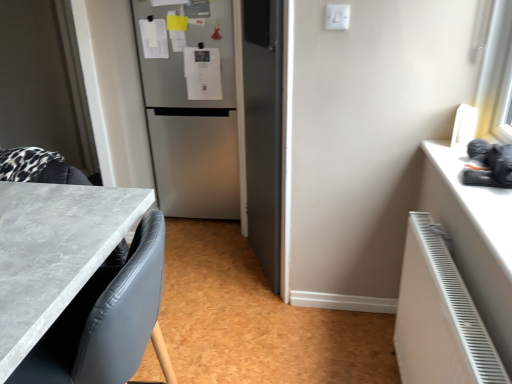
What do you see at coordinates (439, 317) in the screenshot?
I see `white matte radiator at lower right` at bounding box center [439, 317].

Locate an element on the screen. white matte counter top at right is located at coordinates (478, 202).

The height and width of the screenshot is (384, 512). I want to click on gray marble countertop at lower left, so click(x=54, y=250).

The height and width of the screenshot is (384, 512). I want to click on countertop that appears in front of the white matte counter top at right, so click(54, 250).

Considering the sizes of objects white matte counter top at right and gray marble countertop at lower left in the image provided, who is thinner, white matte counter top at right or gray marble countertop at lower left?

Thinner between the two is white matte counter top at right.

Does white matte counter top at right contain gray marble countertop at lower left?

No, gray marble countertop at lower left is not a part of white matte counter top at right.

Consider the image. Is white matte counter top at right far away from gray marble countertop at lower left?

Absolutely, white matte counter top at right is distant from gray marble countertop at lower left.

Between gray marble countertop at lower left and stainless steel refrigerator at center, which one appears on the right side from the viewer's perspective?

From the viewer's perspective, stainless steel refrigerator at center appears more on the right side.

From a real-world perspective, is gray marble countertop at lower left physically above stainless steel refrigerator at center?

No, from a real-world perspective, gray marble countertop at lower left is not over stainless steel refrigerator at center

Is gray marble countertop at lower left thinner than stainless steel refrigerator at center?

Indeed, gray marble countertop at lower left has a lesser width compared to stainless steel refrigerator at center.

Is gray marble countertop at lower left next to stainless steel refrigerator at center?

No, gray marble countertop at lower left is not in contact with stainless steel refrigerator at center.

Based on the photo, is gray marble countertop at lower left wider than white matte radiator at lower right?

Indeed, gray marble countertop at lower left has a greater width compared to white matte radiator at lower right.

Is there a large distance between gray marble countertop at lower left and white matte radiator at lower right?

Actually, gray marble countertop at lower left and white matte radiator at lower right are a little close together.

Identify the location of radiator behind the gray marble countertop at lower left. (439, 317).

From the image's perspective, is gray marble countertop at lower left below white matte radiator at lower right?

No.

Is stainless steel refrigerator at center facing away from gray marble countertop at lower left?

That's not correct — stainless steel refrigerator at center is not looking away from gray marble countertop at lower left.

Can you confirm if stainless steel refrigerator at center is taller than gray marble countertop at lower left?

Indeed, stainless steel refrigerator at center has a greater height compared to gray marble countertop at lower left.

Considering the points (224, 143) and (13, 229), which point is behind, point (224, 143) or point (13, 229)?

The point (224, 143) is farther.

Is stainless steel refrigerator at center directly adjacent to gray marble countertop at lower left?

No, stainless steel refrigerator at center is not in contact with gray marble countertop at lower left.

Can we say white matte counter top at right lies outside white matte radiator at lower right?

That's correct, white matte counter top at right is outside of white matte radiator at lower right.

Consider the image. From the image's perspective, is white matte counter top at right on top of white matte radiator at lower right?

Yes.

Is white matte counter top at right looking in the opposite direction of white matte radiator at lower right?

That's not correct — white matte counter top at right is not looking away from white matte radiator at lower right.

Is white matte counter top at right to the left of white matte radiator at lower right from the viewer's perspective?

No, white matte counter top at right is not to the left of white matte radiator at lower right.

Looking at this image, from a real-world perspective, is white matte radiator at lower right above or below gray marble countertop at lower left?

From a real-world perspective, white matte radiator at lower right is physically below gray marble countertop at lower left.

From the image's perspective, is white matte radiator at lower right under gray marble countertop at lower left?

Yes, from the image's perspective, white matte radiator at lower right is below gray marble countertop at lower left.

Is white matte radiator at lower right smaller than gray marble countertop at lower left?

Yes, white matte radiator at lower right is smaller than gray marble countertop at lower left.

Is white matte radiator at lower right further to the viewer compared to gray marble countertop at lower left?

That is True.

Is gray marble countertop at lower left to the left of white matte counter top at right from the viewer's perspective?

Correct, you'll find gray marble countertop at lower left to the left of white matte counter top at right.

Is gray marble countertop at lower left wider than white matte counter top at right?

Yes, gray marble countertop at lower left is wider than white matte counter top at right.

Is white matte counter top at right located within gray marble countertop at lower left?

No, white matte counter top at right is not surrounded by gray marble countertop at lower left.

Find the location of a particular element. counter top above the gray marble countertop at lower left (from a real-world perspective) is located at coordinates (478, 202).

What are the coordinates of `refrigerator that is above the gray marble countertop at lower left (from the image's perspective)` in the screenshot? It's located at (192, 112).

Looking at the image, which one is located further to gray marble countertop at lower left, stainless steel refrigerator at center or white matte counter top at right?

The object further to gray marble countertop at lower left is stainless steel refrigerator at center.

Looking at the image, which one is located closer to white matte counter top at right, white matte radiator at lower right or gray marble countertop at lower left?

white matte radiator at lower right is positioned closer to the anchor white matte counter top at right.

Estimate the real-world distances between objects in this image. Which object is further from white matte counter top at right, white matte radiator at lower right or stainless steel refrigerator at center?

Among the two, stainless steel refrigerator at center is located further to white matte counter top at right.

From the image, which object appears to be farther from white matte counter top at right, stainless steel refrigerator at center or gray marble countertop at lower left?

Among the two, stainless steel refrigerator at center is located further to white matte counter top at right.

Looking at the image, which one is located further to stainless steel refrigerator at center, white matte radiator at lower right or gray marble countertop at lower left?

Based on the image, white matte radiator at lower right appears to be further to stainless steel refrigerator at center.

Which object lies further to the anchor point white matte radiator at lower right, gray marble countertop at lower left or white matte counter top at right?

Among the two, gray marble countertop at lower left is located further to white matte radiator at lower right.

Considering their positions, is white matte counter top at right positioned further to gray marble countertop at lower left than white matte radiator at lower right?

white matte counter top at right is further to gray marble countertop at lower left.

Based on their spatial positions, is gray marble countertop at lower left or stainless steel refrigerator at center further from white matte radiator at lower right?

stainless steel refrigerator at center is further to white matte radiator at lower right.

What are the coordinates of `radiator between gray marble countertop at lower left and stainless steel refrigerator at center in the front-back direction` in the screenshot? It's located at (439, 317).

Locate an element on the screen. The height and width of the screenshot is (384, 512). counter top between gray marble countertop at lower left and stainless steel refrigerator at center in the front-back direction is located at coordinates (478, 202).

You are a GUI agent. You are given a task and a screenshot of the screen. Output one action in this format:
    pyautogui.click(x=<x>, y=<y>)
    Task: Click on the counter top located between white matte radiator at lower right and stainless steel refrigerator at center in the depth direction
    The height and width of the screenshot is (384, 512).
    Given the screenshot: What is the action you would take?
    point(478,202)

Identify the location of radiator situated between gray marble countertop at lower left and white matte counter top at right from left to right. (439, 317).